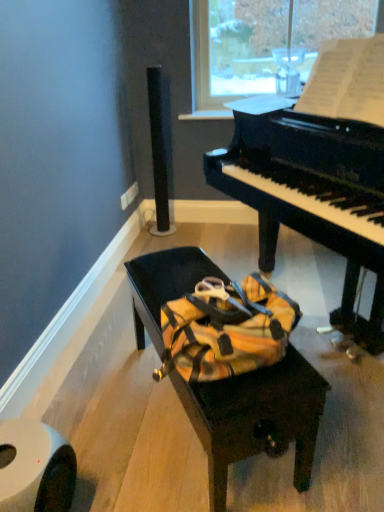
Locate an element on the screen. vacant area situated to the left side of matte black bench at center is located at coordinates (x=105, y=401).